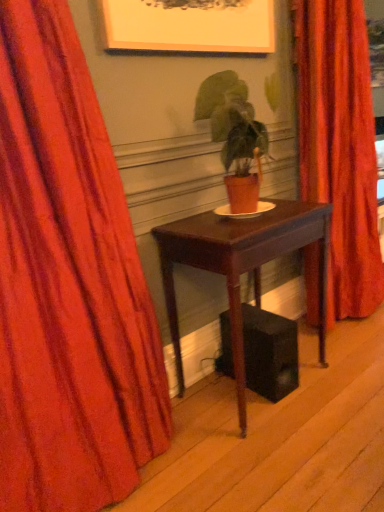
Question: From a real-world perspective, is mahogany wood table at center below velvet orange curtain at center, which ranks as the 1th curtain in back-to-front order?

Choices:
 (A) yes
 (B) no

Answer: (A)

Question: Does mahogany wood table at center contain velvet orange curtain at center, which ranks as the 1th curtain in back-to-front order?

Choices:
 (A) yes
 (B) no

Answer: (B)

Question: Is mahogany wood table at center at the left side of velvet orange curtain at center, which ranks as the 1th curtain in back-to-front order?

Choices:
 (A) yes
 (B) no

Answer: (A)

Question: Does mahogany wood table at center have a larger size compared to velvet orange curtain at center, marked as the 2th curtain in a front-to-back arrangement?

Choices:
 (A) no
 (B) yes

Answer: (A)

Question: Considering the relative sizes of mahogany wood table at center and velvet orange curtain at center, which ranks as the 1th curtain in back-to-front order, in the image provided, is mahogany wood table at center smaller than velvet orange curtain at center, which ranks as the 1th curtain in back-to-front order,?

Choices:
 (A) no
 (B) yes

Answer: (B)

Question: Considering the positions of point (233, 350) and point (324, 103), is point (233, 350) closer or farther from the camera than point (324, 103)?

Choices:
 (A) farther
 (B) closer

Answer: (B)

Question: Considering the positions of mahogany wood table at center and velvet orange curtain at center, marked as the 2th curtain in a front-to-back arrangement, in the image, is mahogany wood table at center wider or thinner than velvet orange curtain at center, marked as the 2th curtain in a front-to-back arrangement,?

Choices:
 (A) thin
 (B) wide

Answer: (B)

Question: Considering the relative positions of mahogany wood table at center and velvet orange curtain at center, marked as the 2th curtain in a front-to-back arrangement, in the image provided, is mahogany wood table at center to the left or to the right of velvet orange curtain at center, marked as the 2th curtain in a front-to-back arrangement,?

Choices:
 (A) right
 (B) left

Answer: (B)

Question: From a real-world perspective, is mahogany wood table at center above or below velvet orange curtain at center, which ranks as the first curtain in right-to-left order?

Choices:
 (A) below
 (B) above

Answer: (A)

Question: Relative to velvet red curtain at left, which ranks as the first curtain in front-to-back order, is velvet orange curtain at center, which ranks as the first curtain in right-to-left order, in front or behind?

Choices:
 (A) behind
 (B) front

Answer: (A)

Question: From the image's perspective, is velvet orange curtain at center, which ranks as the first curtain in right-to-left order, above or below velvet red curtain at left, which is counted as the second curtain, starting from the right?

Choices:
 (A) below
 (B) above

Answer: (B)

Question: Based on their positions, is velvet orange curtain at center, which ranks as the first curtain in right-to-left order, located to the left or right of velvet red curtain at left, which is counted as the second curtain, starting from the right?

Choices:
 (A) right
 (B) left

Answer: (A)

Question: From a real-world perspective, is velvet orange curtain at center, which ranks as the 1th curtain in back-to-front order, physically located above or below velvet red curtain at left, acting as the 2th curtain starting from the back?

Choices:
 (A) below
 (B) above

Answer: (B)

Question: Is matte orange pot at center inside the boundaries of velvet orange curtain at center, which ranks as the first curtain in right-to-left order, or outside?

Choices:
 (A) inside
 (B) outside

Answer: (B)

Question: Is point (233, 160) closer or farther from the camera than point (382, 275)?

Choices:
 (A) farther
 (B) closer

Answer: (B)